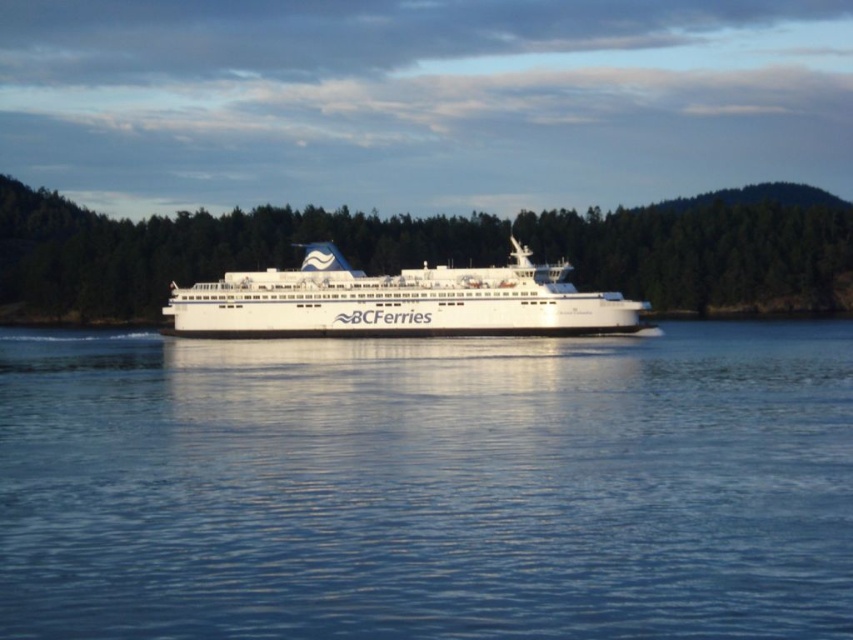
You are a passenger on the ferry and want to take a photo of the water. Based on the scene, where should you position yourself relative to the white glossy ferry at center to capture the blue liquid water at center in your shot?

To capture the blue liquid water at center in your photo, you should position yourself to the right side of the white glossy ferry at center since the blue liquid water at center is positioned on the right side of it.

In the scene shown: You are a photographer planning to capture the ferry and the surrounding water in a single shot. Given the scene, can you determine if the blue liquid water at center will occupy more horizontal space than the white glossy ferry at center in your photo?

The blue liquid water at center is wider than the white glossy ferry at center, so yes, the blue liquid water at center will occupy more horizontal space in the photo.